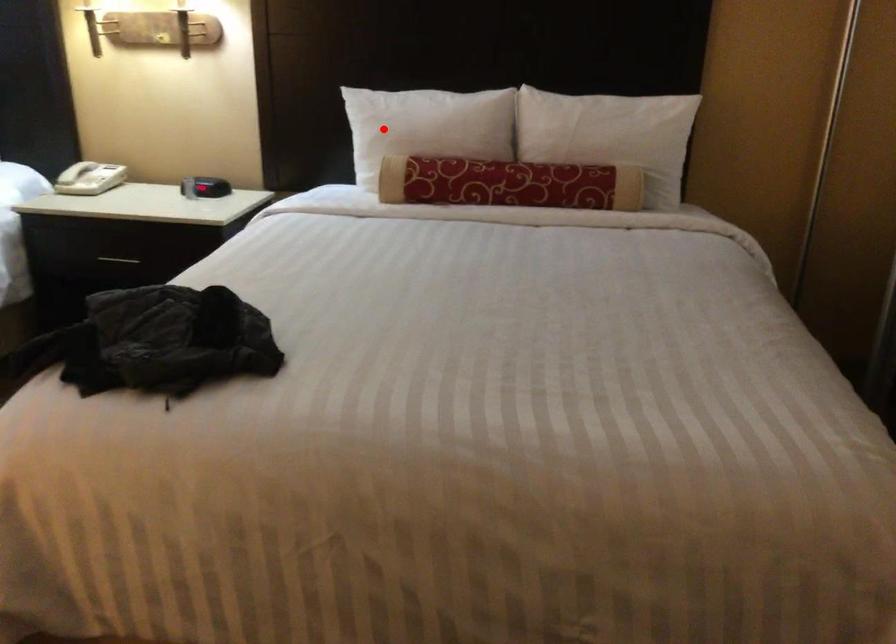
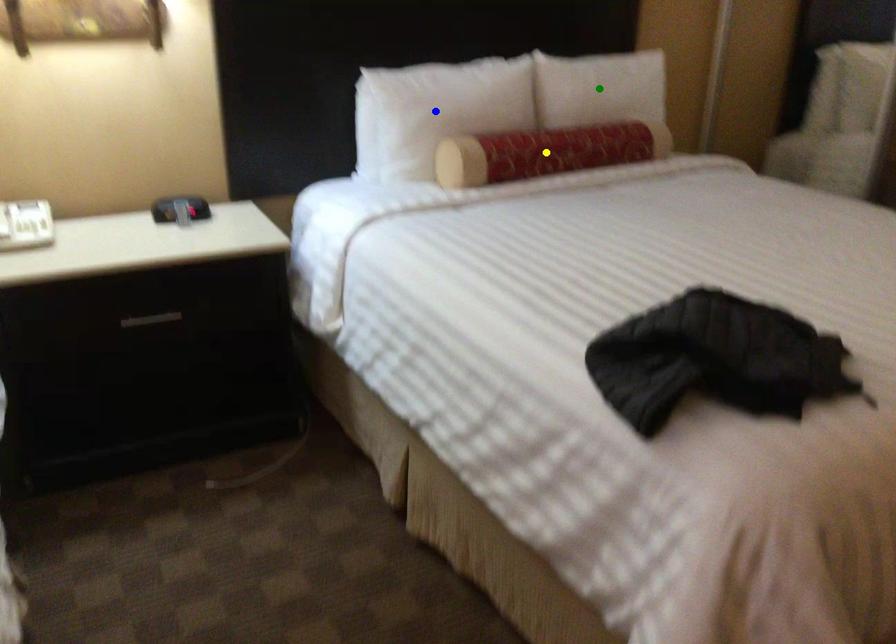
Question: I am providing you with two images of the same scene from different viewpoints. A red point is marked on the first image. You are given multiple points on the second image. Which point in image 2 is actually the same real-world point as the red point in image 1?

Choices:
 (A) blue point
 (B) green point
 (C) yellow point

Answer: (A)